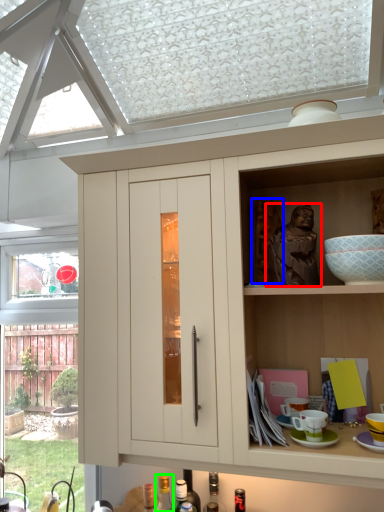
Question: Considering the real-world distances, which object is closest to person (highlighted by a red box)? sculpture (highlighted by a blue box) or bottle (highlighted by a green box).

Choices:
 (A) sculpture
 (B) bottle

Answer: (A)